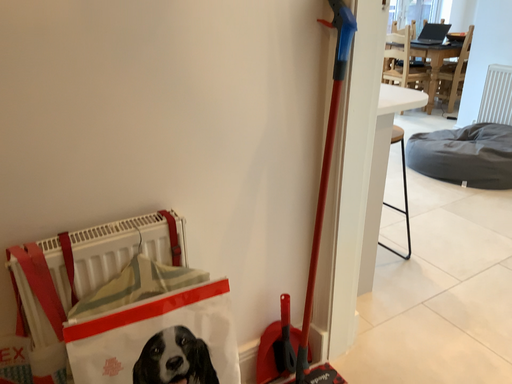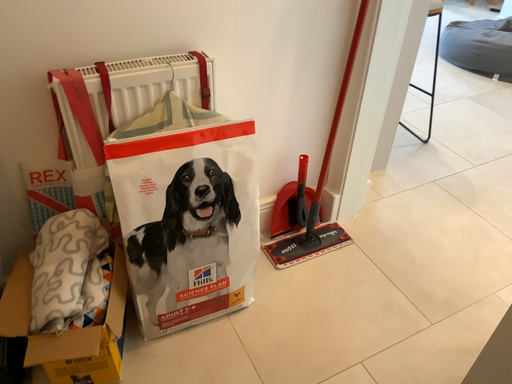
Question: How did the camera likely rotate when shooting the video?

Choices:
 (A) rotated downward
 (B) rotated upward

Answer: (A)